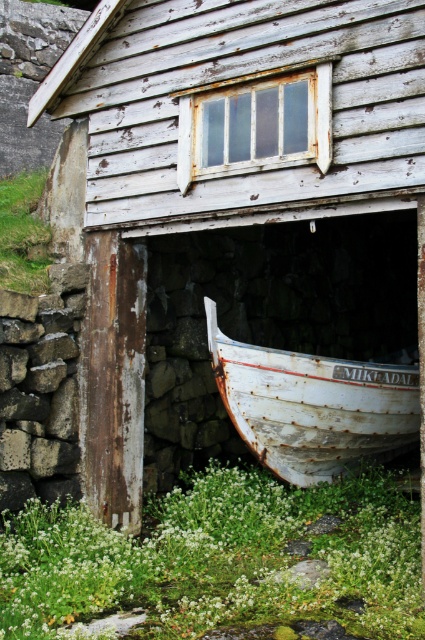
Question: Can you confirm if green leafy weed at lower center is positioned to the right of rusty white boat at lower center?

Choices:
 (A) no
 (B) yes

Answer: (A)

Question: Considering the relative positions of green leafy weed at lower center and rusty white boat at lower center in the image provided, where is green leafy weed at lower center located with respect to rusty white boat at lower center?

Choices:
 (A) right
 (B) left

Answer: (B)

Question: Which object appears farthest from the camera in this image?

Choices:
 (A) rusty white boat at lower center
 (B) green leafy weed at lower center

Answer: (A)

Question: Does green leafy weed at lower center appear under rusty white boat at lower center?

Choices:
 (A) no
 (B) yes

Answer: (B)